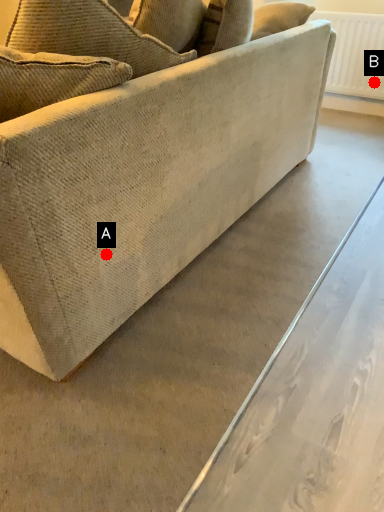
Question: Two points are circled on the image, labeled by A and B beside each circle. Which of the following is the closest to the observer?

Choices:
 (A) A is closer
 (B) B is closer

Answer: (A)